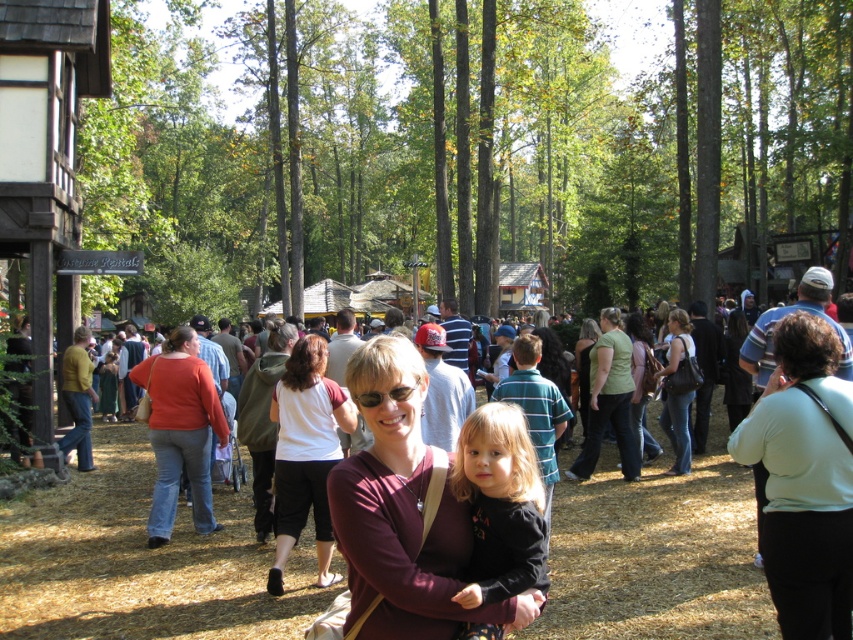
Question: Is light green fabric at center further to the viewer compared to white cotton shirt at center?

Choices:
 (A) no
 (B) yes

Answer: (A)

Question: Does white cotton shirt at center appear on the right side of matte black purse at center?

Choices:
 (A) no
 (B) yes

Answer: (A)

Question: In this image, where is black matte shirt at center located relative to light green fabric shirt at center?

Choices:
 (A) above
 (B) below

Answer: (A)

Question: Based on their relative distances, which object is nearer to the white cotton shirt at center?

Choices:
 (A) light green fabric at center
 (B) matte black purse at center

Answer: (A)

Question: Which object is closer to the camera taking this photo?

Choices:
 (A) green matte shirt at center
 (B) matte red shirt at center
 (C) maroon fabric shirt at center

Answer: (C)

Question: Considering the real-world distances, which object is farthest from the light green fabric at center?

Choices:
 (A) black matte shirt at center
 (B) light green fabric shirt at center
 (C) white cotton shirt at center
 (D) maroon fabric shirt at center

Answer: (B)